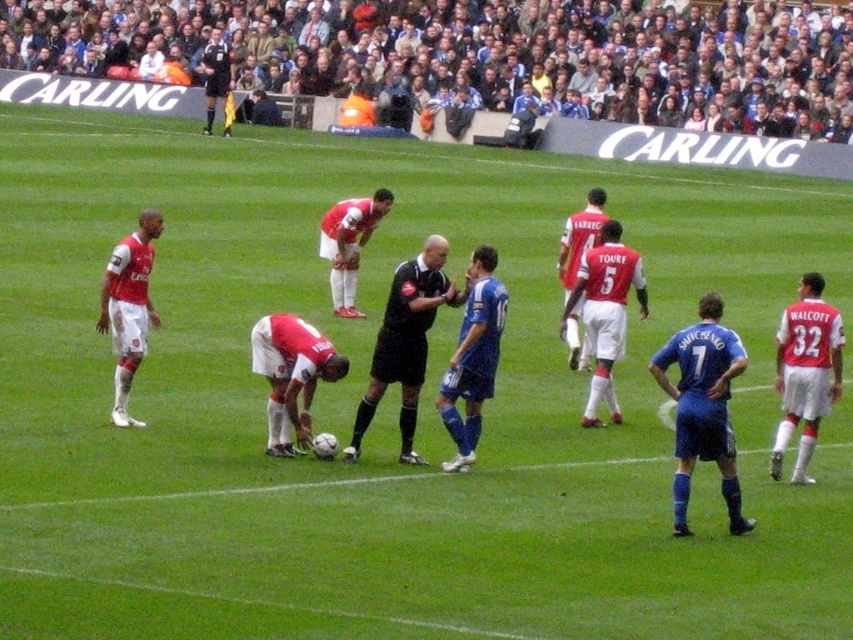
You are a soccer player positioned at the edge of the field. You need to quickly identify the tallest object between the matte white shorts at center and the black uniformed official at upper center to determine where to focus your next move. Which object is taller?

The matte white shorts at center is much taller than the black uniformed official at upper center, so you should focus your next move on the matte white shorts at center.

You are a spectator at the soccer match. You notice the matte white shorts at center and the black uniformed official at upper center. Which of these two is positioned higher from the ground?

The black uniformed official at upper center is positioned higher from the ground than the matte white shorts at center.

You are a photographer standing at the edge of the soccer field. You want to take a photo of the matte red uniform at center without the dark gray fabric crowd at upper center appearing in the frame. Which direction should you move to ensure the crowd is out of the shot?

You should move to the right since the dark gray fabric crowd at upper center is to the left of the matte red uniform at center. By moving right, you can position yourself so the crowd is no longer in the frame.